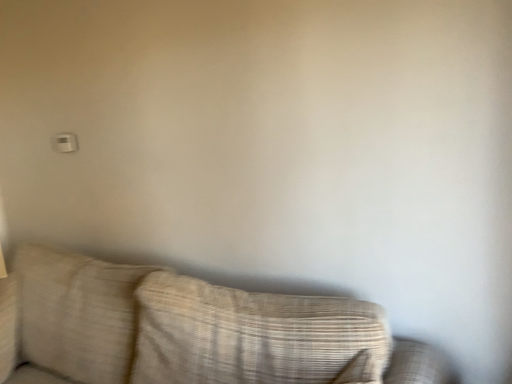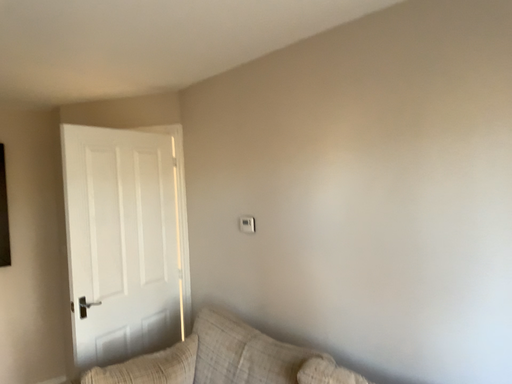
Question: How did the camera likely rotate when shooting the video?

Choices:
 (A) rotated left
 (B) rotated right

Answer: (A)